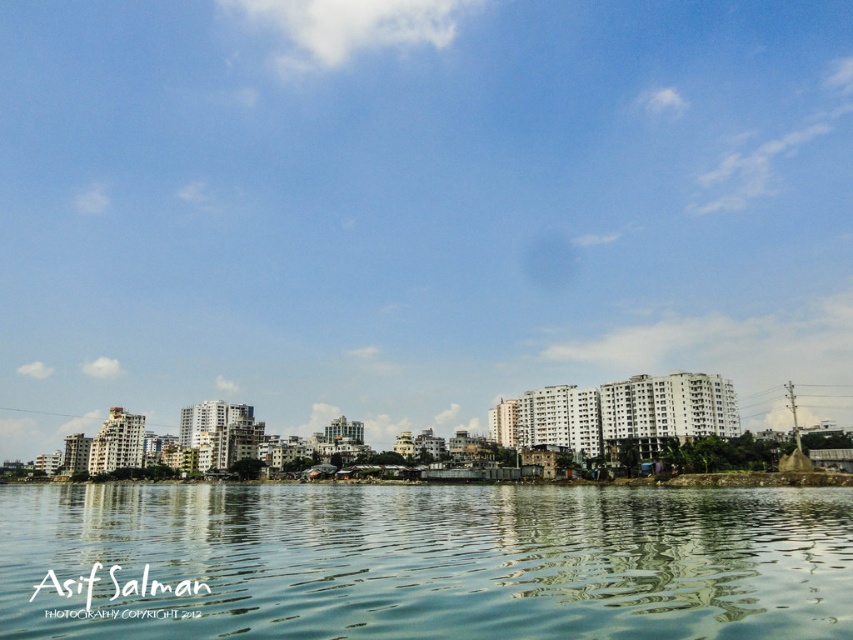
You are standing on a dock and looking at the blue sky at upper center and the clear water at center. Which object is positioned higher in the scene?

The blue sky at upper center is located above the clear water at center, so it is positioned higher in the scene.